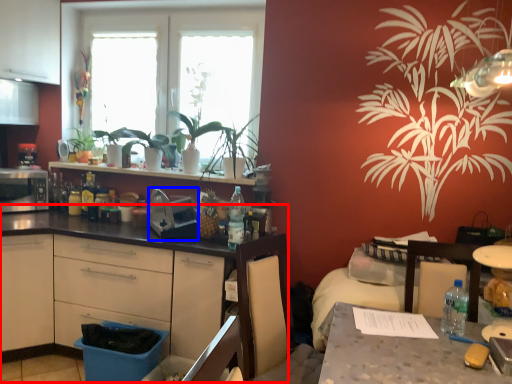
Question: Which object is further to the camera taking this photo, countertop (highlighted by a red box) or appliance (highlighted by a blue box)?

Choices:
 (A) countertop
 (B) appliance

Answer: (B)